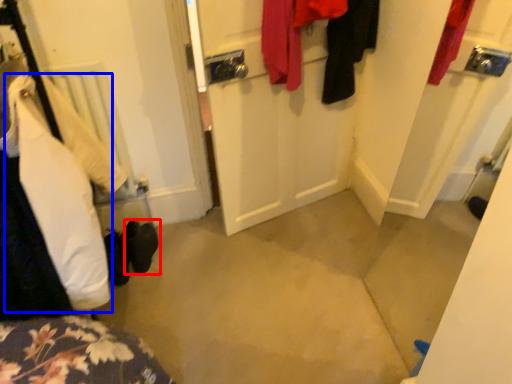
Question: Which of the following is the farthest to the observer, footwear (highlighted by a red box) or clothing (highlighted by a blue box)?

Choices:
 (A) footwear
 (B) clothing

Answer: (A)